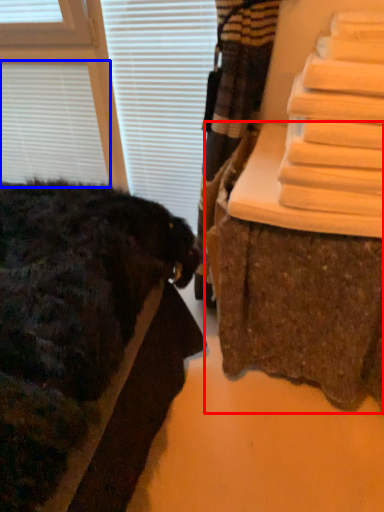
Question: Which object is further to the camera taking this photo, furniture (highlighted by a red box) or blind (highlighted by a blue box)?

Choices:
 (A) furniture
 (B) blind

Answer: (B)